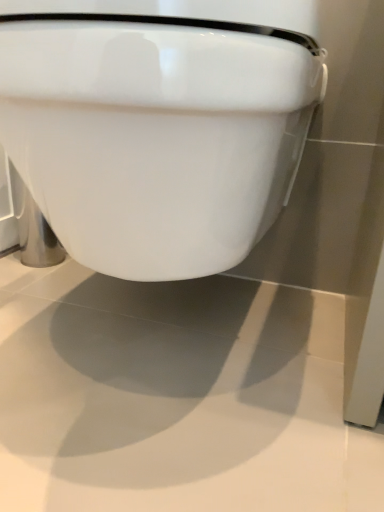
What do you see at coordinates (158, 124) in the screenshot? I see `white glossy toilet at center` at bounding box center [158, 124].

Find the location of a particular element. white glossy toilet at center is located at coordinates (158, 124).

This screenshot has height=512, width=384. Identify the location of white glossy toilet at center. (158, 124).